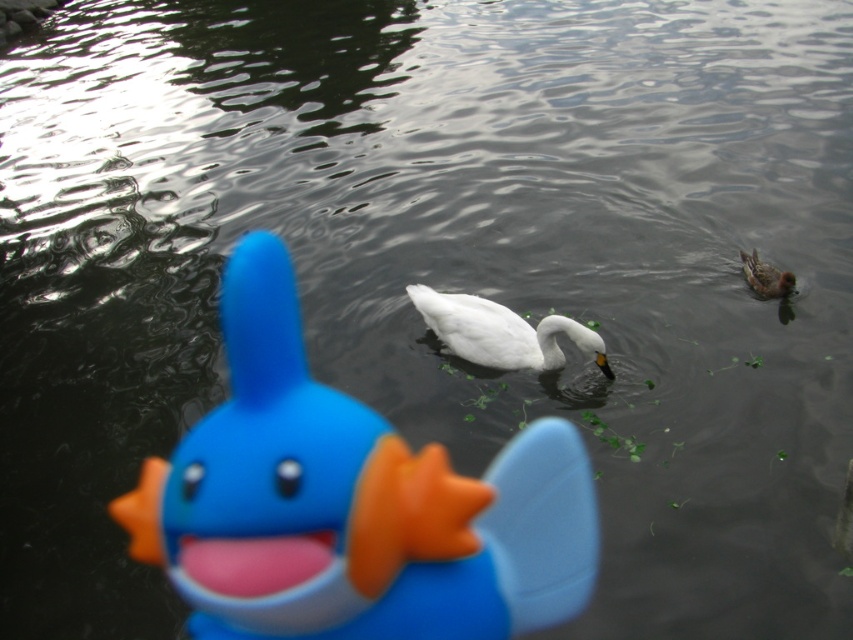
Question: Based on their relative distances, which object is farther from the rubber duck at center?

Choices:
 (A) white matte swan at center
 (B) brown speckled feathers at upper right

Answer: (B)

Question: Which point is closer to the camera taking this photo?

Choices:
 (A) (213, 566)
 (B) (502, 355)
 (C) (759, 273)

Answer: (A)

Question: Estimate the real-world distances between objects in this image. Which object is closer to the white matte swan at center?

Choices:
 (A) brown speckled feathers at upper right
 (B) rubber duck at center

Answer: (B)

Question: Does rubber duck at center lie in front of brown speckled feathers at upper right?

Choices:
 (A) no
 (B) yes

Answer: (B)

Question: Does rubber duck at center have a lesser width compared to white matte swan at center?

Choices:
 (A) yes
 (B) no

Answer: (A)

Question: Does rubber duck at center appear over white matte swan at center?

Choices:
 (A) no
 (B) yes

Answer: (A)